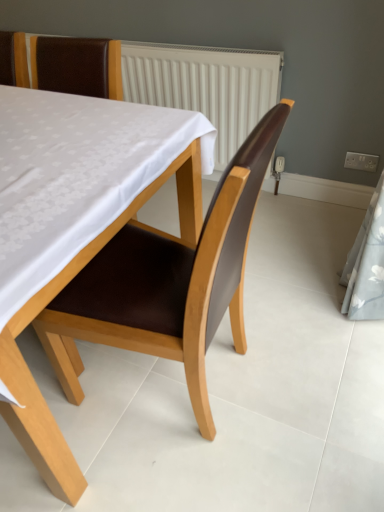
You are a GUI agent. You are given a task and a screenshot of the screen. Output one action in this format:
    pyautogui.click(x=<x>, y=<y>)
    Task: Click on the empty space that is to the right of brown leather chair at center, marked as the 2th chair in a top-to-bottom arrangement
    The image size is (384, 512).
    Given the screenshot: What is the action you would take?
    pyautogui.click(x=306, y=359)